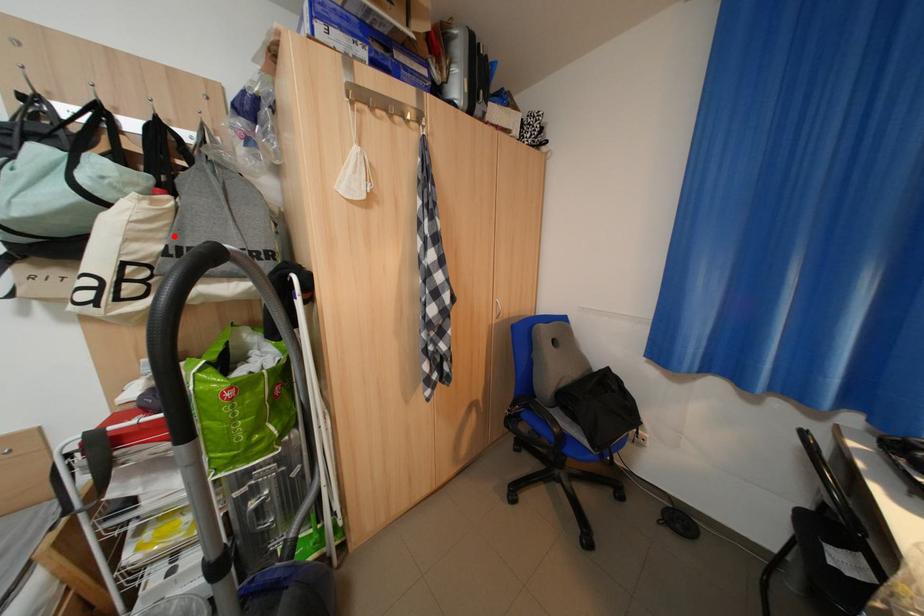
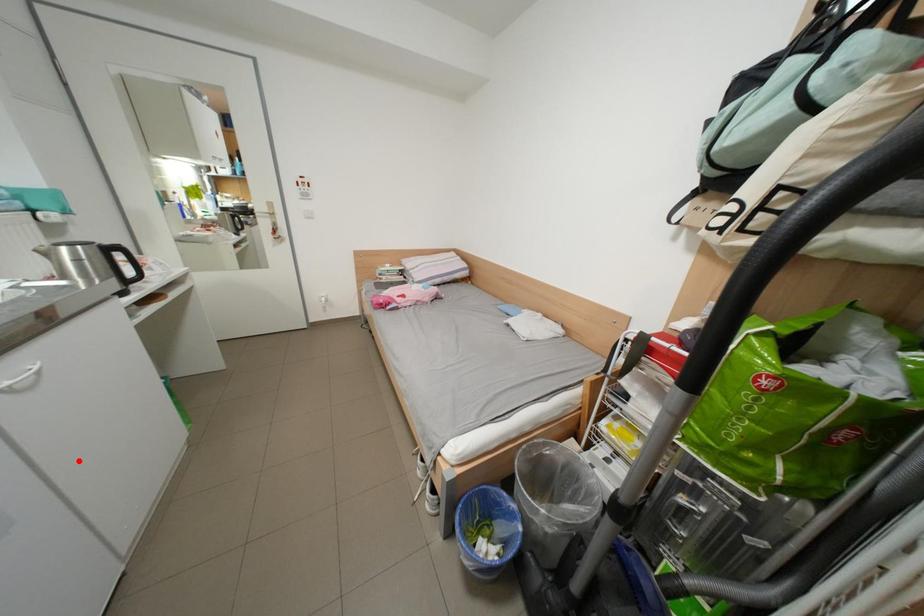
I am providing you with two images of the same scene from different viewpoints. A red point is marked on the first image and another point is marked on the second image. Is the marked point in image1 the same physical position as the marked point in image2?

No